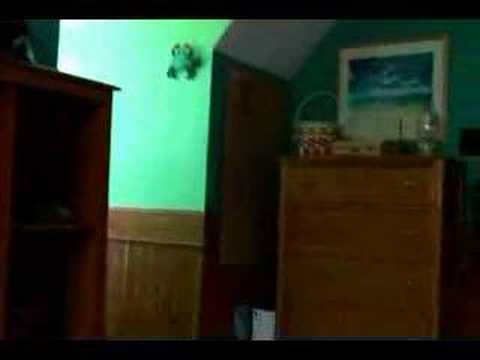
Image resolution: width=480 pixels, height=360 pixels. I want to click on painting, so click(396, 103).